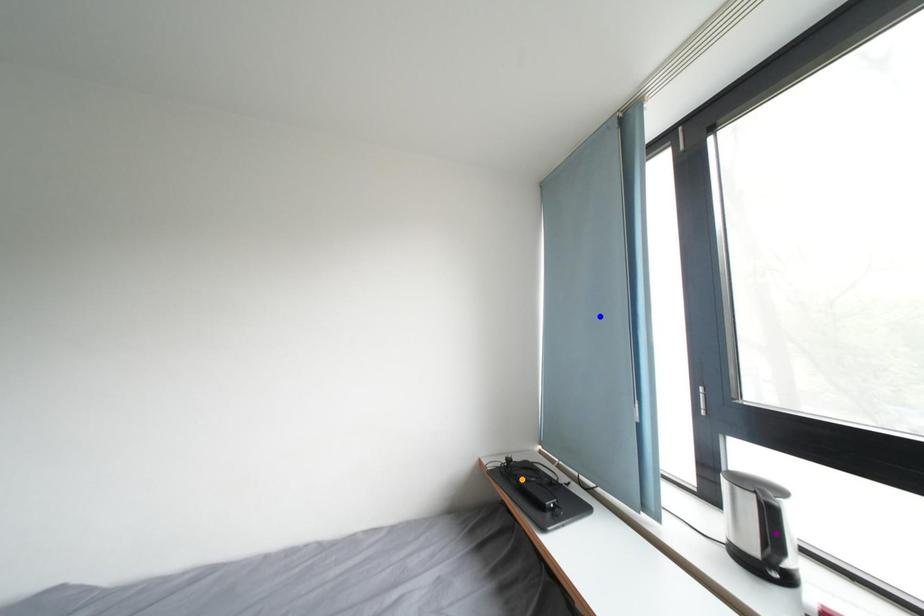
Consider the image. Order these from nearest to farthest:
A) purple point
B) blue point
C) orange point

purple point < blue point < orange point